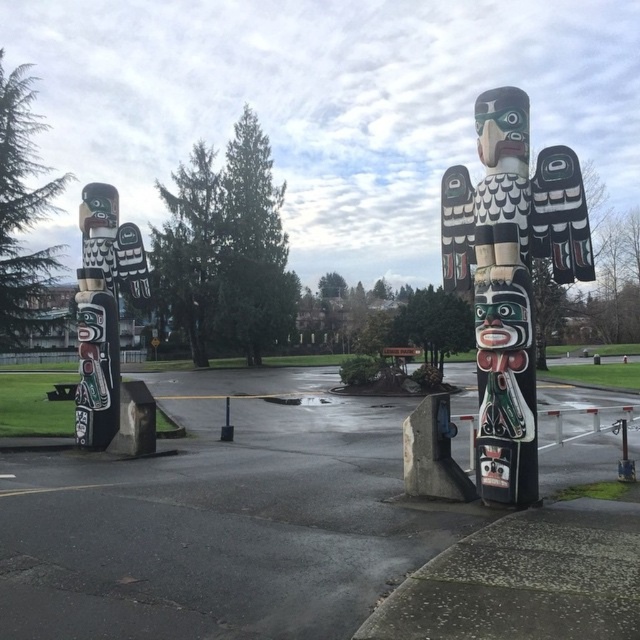
Who is lower down, smooth asphalt parking lot at center or black painted wood totem pole at right?

smooth asphalt parking lot at center

Does smooth asphalt parking lot at center have a lesser width compared to black painted wood totem pole at right?

No, smooth asphalt parking lot at center is not thinner than black painted wood totem pole at right.

You are a GUI agent. You are given a task and a screenshot of the screen. Output one action in this format:
    pyautogui.click(x=<x>, y=<y>)
    Task: Click on the smooth asphalt parking lot at center
    
    Given the screenshot: What is the action you would take?
    pyautogui.click(x=220, y=529)

Looking at this image, between smooth asphalt parking lot at center and polished wood totem pole at left, which one appears on the left side from the viewer's perspective?

Positioned to the left is polished wood totem pole at left.

Between point (262, 506) and point (96, 268), which one is positioned in front?

Point (262, 506)

Describe the element at coordinates (220, 529) in the screenshot. I see `smooth asphalt parking lot at center` at that location.

At what (x,y) coordinates should I click in order to perform the action: click on smooth asphalt parking lot at center. Please return your answer as a coordinate pair (x, y). The height and width of the screenshot is (640, 640). Looking at the image, I should click on (220, 529).

Is point (563, 252) farther from camera compared to point (92, 188)?

No, it is not.

Find the location of `black painted wood totem pole at right`. black painted wood totem pole at right is located at coordinates (509, 276).

The height and width of the screenshot is (640, 640). What do you see at coordinates (509, 276) in the screenshot? I see `black painted wood totem pole at right` at bounding box center [509, 276].

Find the location of a particular element. This screenshot has width=640, height=640. black painted wood totem pole at right is located at coordinates (509, 276).